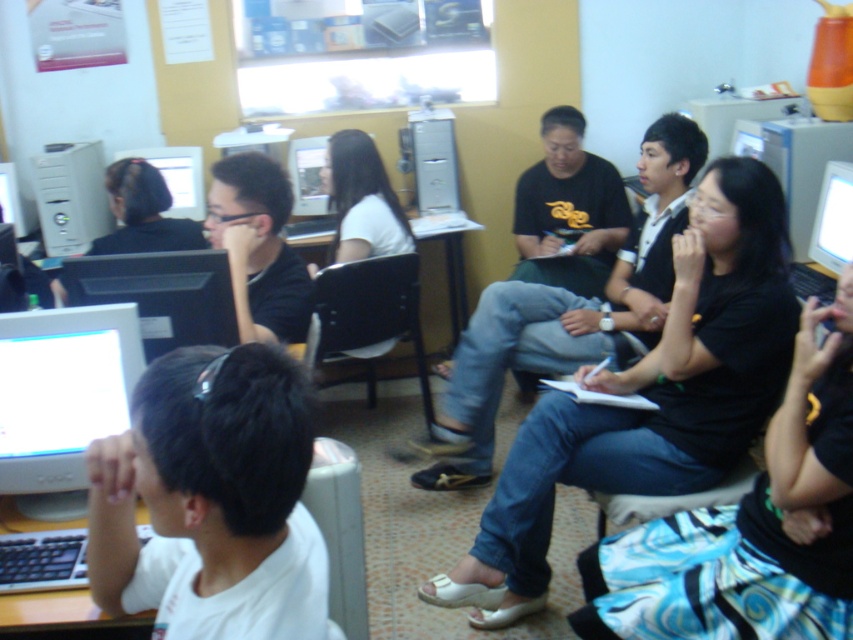
You are setting up a new computer desk and need to know the width of the monitors to arrange them properly. Which monitor, the matte black monitor at center or the bright white plastic monitor at upper right, has a greater width?

The matte black monitor at center might be wider than bright white plastic monitor at upper right according to the description.

You are standing in the computer lab and want to reach a point that is exactly 1.48 meters away from you. Can you reach the point labeled as point (3,390)?

Yes, the point labeled as point (3,390) is exactly 1.48 meters from the viewer, so you can reach it.